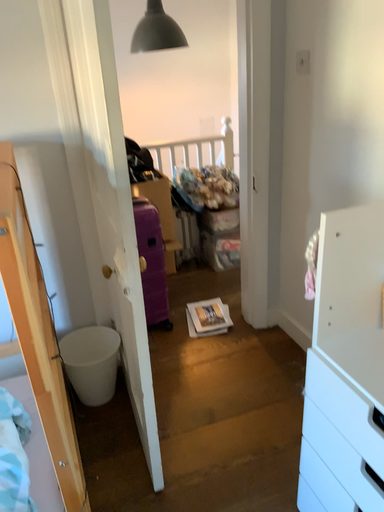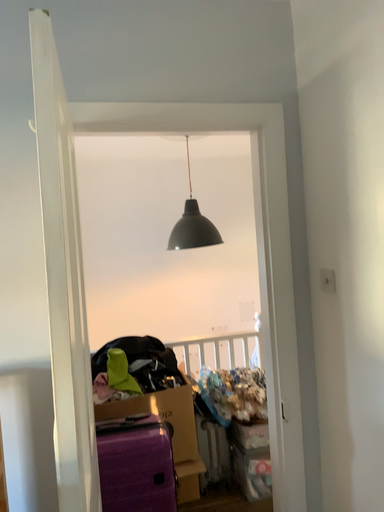
Question: Which way did the camera rotate in the video?

Choices:
 (A) rotated upward
 (B) rotated downward

Answer: (A)